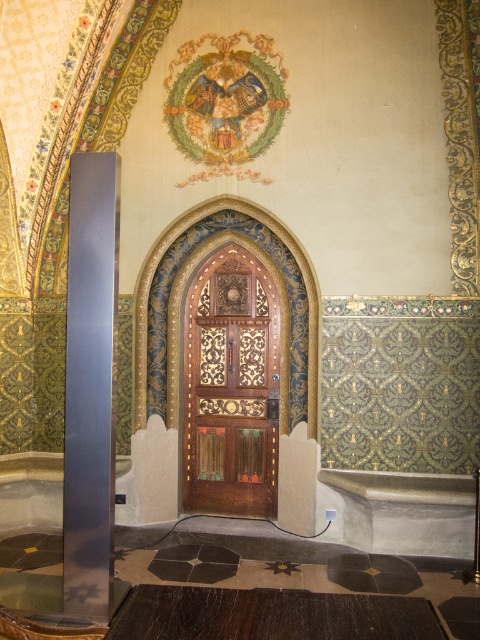
You are an interior designer assessing the proportions of the room. Given that the wooden carved door at center and the satin silver pole at left are both central to the design, which object is taller?

The wooden carved door at center is taller than the satin silver pole at left according to the description.

You are an interior designer planning to place a new decorative item between the wooden carved door at center and the satin silver pole at left. Based on their positions, which object should the new item be closer to?

The wooden carved door at center is to the right of the satin silver pole at left, so the new decorative item should be placed closer to the satin silver pole at left to maintain symmetry between the two objects.